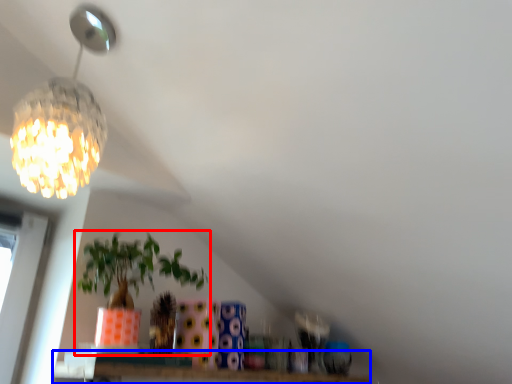
Question: Which of the following is the farthest to the observer, houseplant (highlighted by a red box) or window (highlighted by a blue box)?

Choices:
 (A) houseplant
 (B) window

Answer: (B)